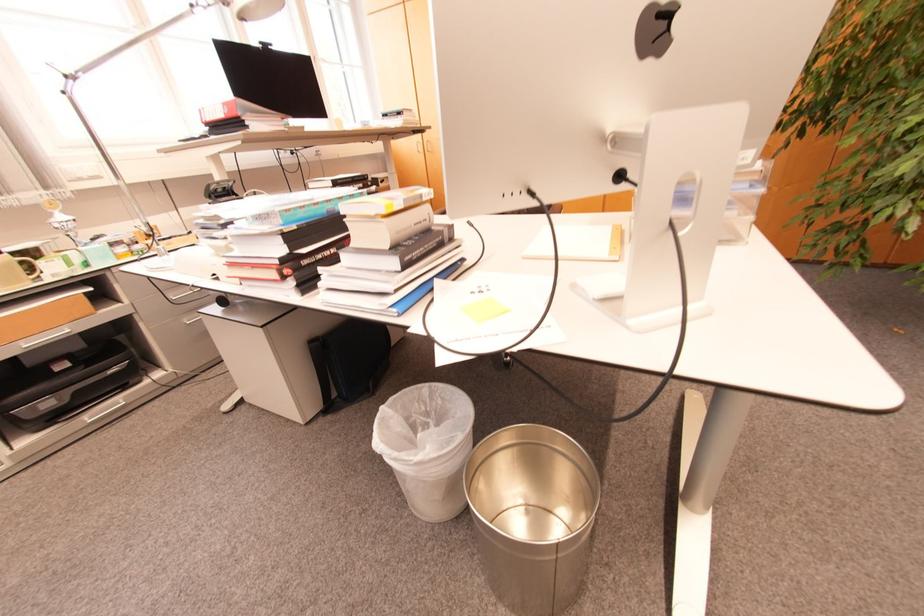
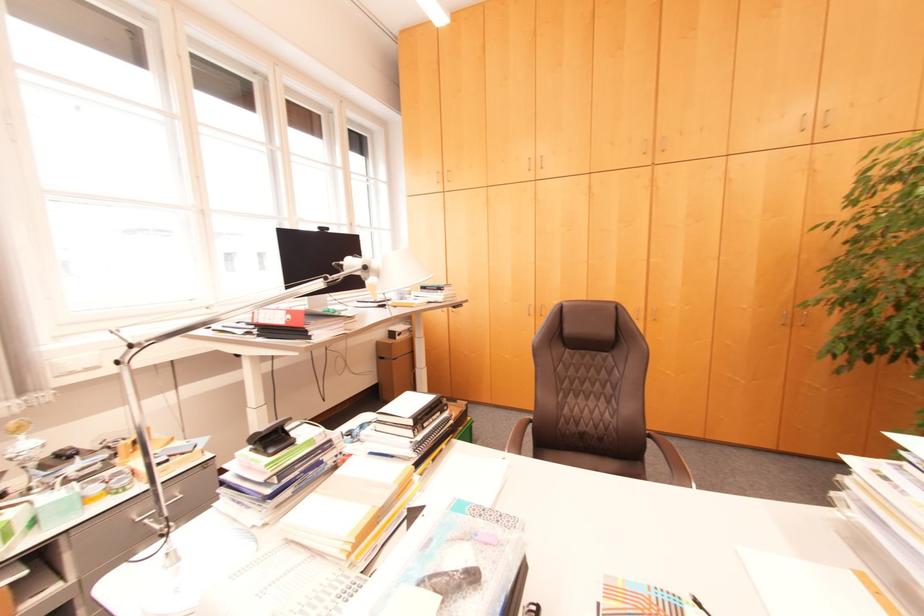
Question: How did the camera likely rotate?

Choices:
 (A) Left
 (B) Right
 (C) Up
 (D) Down

Answer: (C)